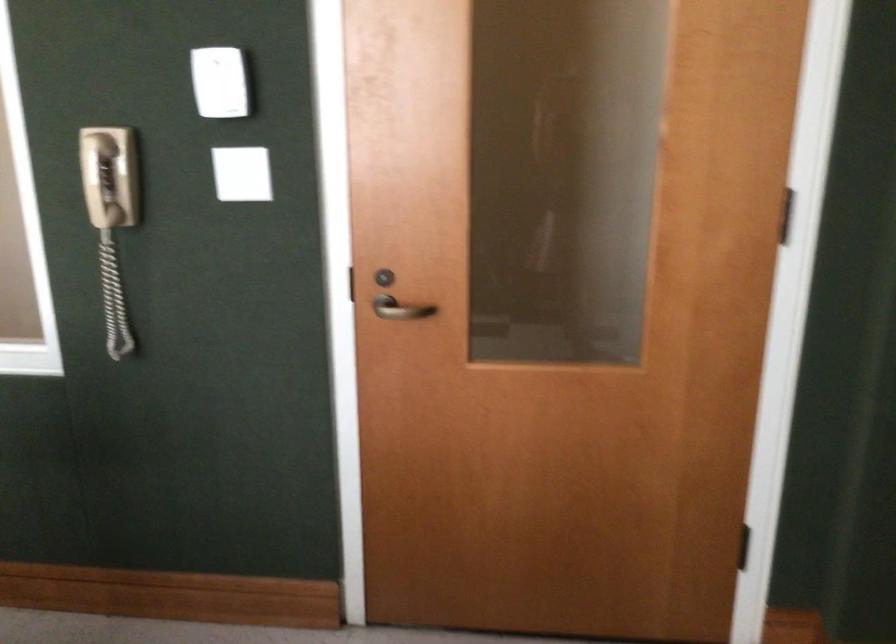
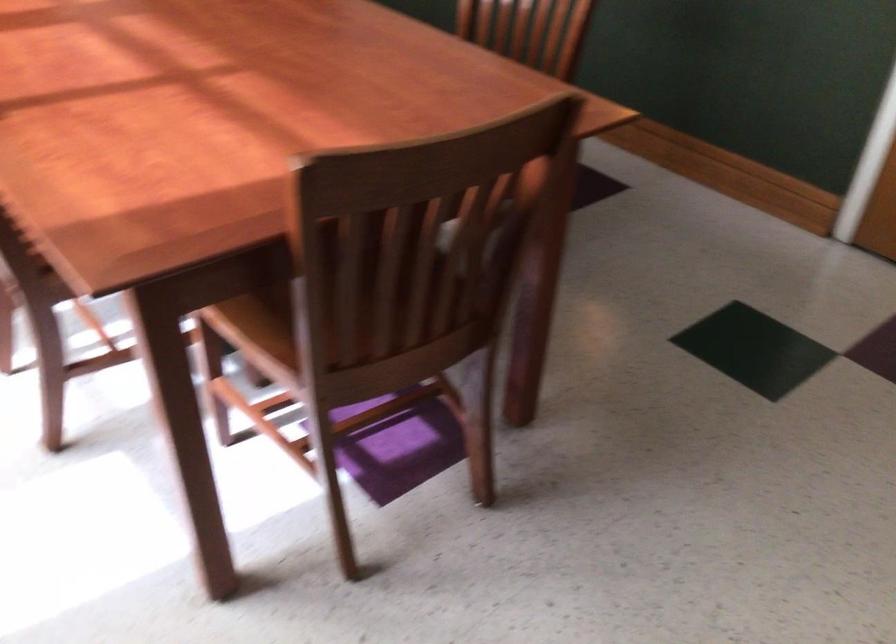
Based on the continuous images, in which direction is the camera rotating?

The rotation direction of the camera is left-down.